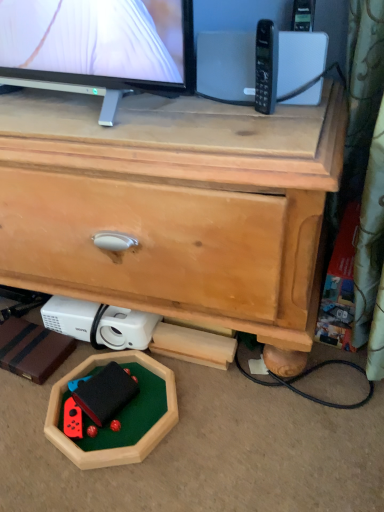
Question: Is wooden chest of drawers at center to the right of rubberized black toy at lower center from the viewer's perspective?

Choices:
 (A) no
 (B) yes

Answer: (A)

Question: Can you confirm if wooden chest of drawers at center is taller than rubberized black toy at lower center?

Choices:
 (A) no
 (B) yes

Answer: (B)

Question: Is wooden chest of drawers at center smaller than rubberized black toy at lower center?

Choices:
 (A) yes
 (B) no

Answer: (B)

Question: From a real-world perspective, is wooden chest of drawers at center located higher than rubberized black toy at lower center?

Choices:
 (A) no
 (B) yes

Answer: (B)

Question: Considering the relative sizes of wooden chest of drawers at center and rubberized black toy at lower center in the image provided, is wooden chest of drawers at center bigger than rubberized black toy at lower center?

Choices:
 (A) no
 (B) yes

Answer: (B)

Question: Considering their positions, is rubberized black toy at lower center located in front of or behind white plastic projector at lower left?

Choices:
 (A) behind
 (B) front

Answer: (B)

Question: Based on their sizes in the image, would you say rubberized black toy at lower center is bigger or smaller than white plastic projector at lower left?

Choices:
 (A) small
 (B) big

Answer: (A)

Question: Is rubberized black toy at lower center taller or shorter than white plastic projector at lower left?

Choices:
 (A) tall
 (B) short

Answer: (B)

Question: From a real-world perspective, is rubberized black toy at lower center physically located above or below white plastic projector at lower left?

Choices:
 (A) below
 (B) above

Answer: (A)

Question: Is white plastic projector at lower left wider or thinner than black plastic phone at upper right?

Choices:
 (A) thin
 (B) wide

Answer: (B)

Question: In terms of height, does white plastic projector at lower left look taller or shorter compared to black plastic phone at upper right?

Choices:
 (A) tall
 (B) short

Answer: (B)

Question: Does point (117, 336) appear closer or farther from the camera than point (256, 59)?

Choices:
 (A) farther
 (B) closer

Answer: (A)

Question: From the image's perspective, is white plastic projector at lower left positioned above or below black plastic phone at upper right?

Choices:
 (A) above
 (B) below

Answer: (B)

Question: From the image's perspective, is rubberized black toy at lower center positioned above or below wooden chest of drawers at center?

Choices:
 (A) below
 (B) above

Answer: (A)

Question: In the image, is rubberized black toy at lower center on the left side or the right side of wooden chest of drawers at center?

Choices:
 (A) left
 (B) right

Answer: (B)